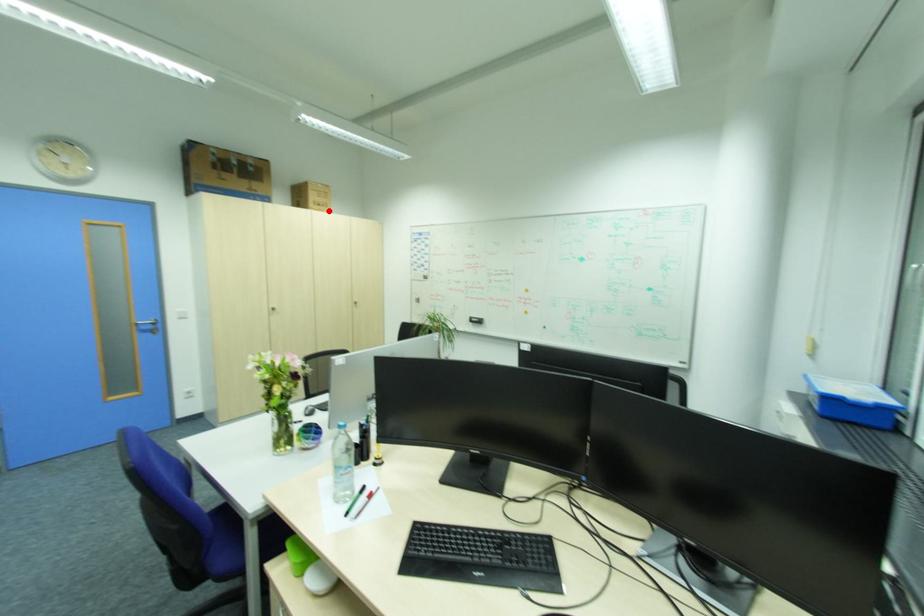
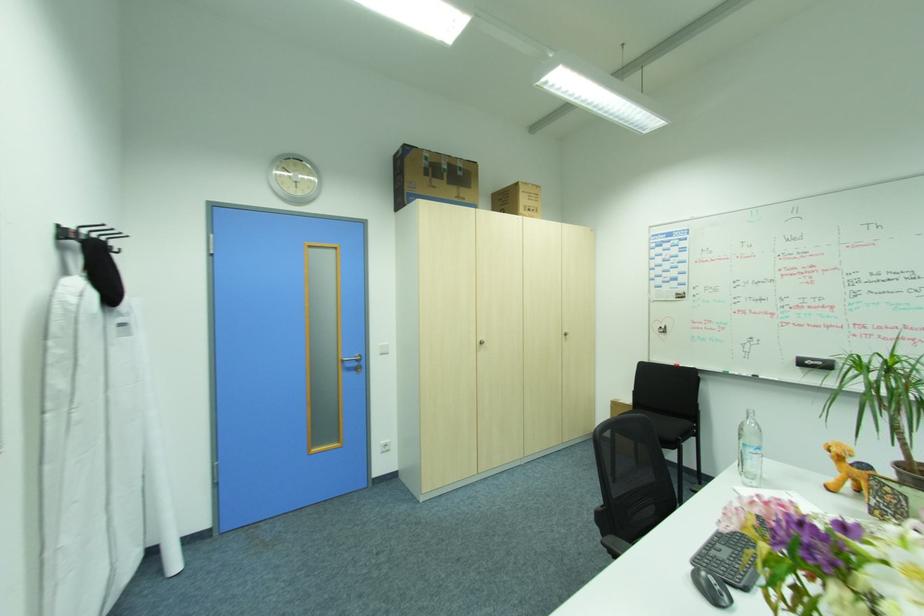
Locate, in the second image, the point that corresponds to the highlighted location in the first image.

(538, 217)